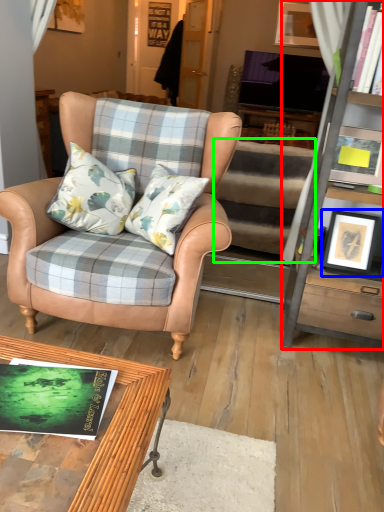
Question: Which object is positioned closest to cabinetry (highlighted by a red box)? Select from picture frame (highlighted by a blue box) and stair (highlighted by a green box).

Choices:
 (A) picture frame
 (B) stair

Answer: (A)